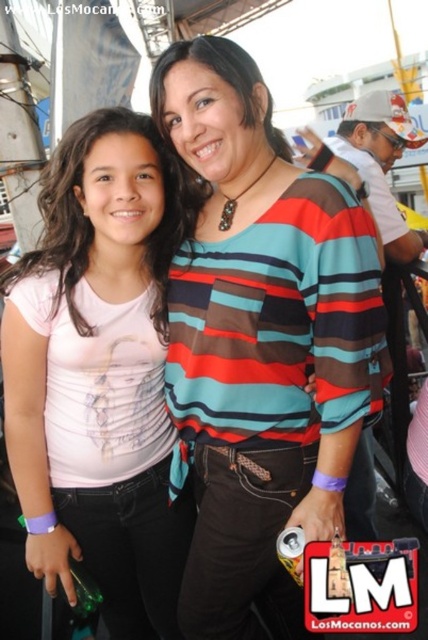
Question: Does striped cotton shirt at center appear on the right side of pink matte shirt at center?

Choices:
 (A) yes
 (B) no

Answer: (A)

Question: Can you confirm if striped cotton shirt at center is positioned below pink matte shirt at center?

Choices:
 (A) yes
 (B) no

Answer: (B)

Question: Which point is closer to the camera?

Choices:
 (A) (104, 547)
 (B) (278, 355)

Answer: (B)

Question: Does striped cotton shirt at center have a larger size compared to pink matte shirt at center?

Choices:
 (A) yes
 (B) no

Answer: (A)

Question: Which of the following is the farthest from the observer?

Choices:
 (A) striped cotton shirt at center
 (B) pink matte shirt at center

Answer: (B)

Question: Which point is farther to the camera?

Choices:
 (A) (348, 202)
 (B) (14, 289)

Answer: (B)